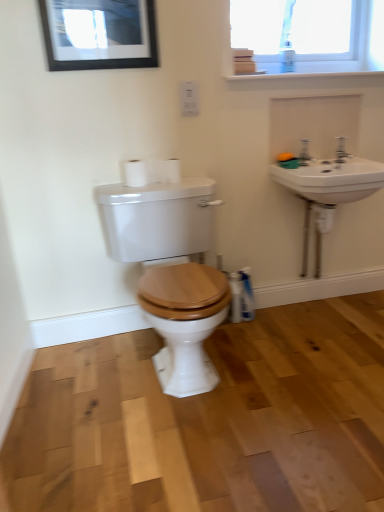
At what (x,y) coordinates should I click in order to perform the action: click on vacant space in front of wooden toilet seat at center. Please return your answer as a coordinate pair (x, y). Image resolution: width=384 pixels, height=512 pixels. Looking at the image, I should click on (174, 450).